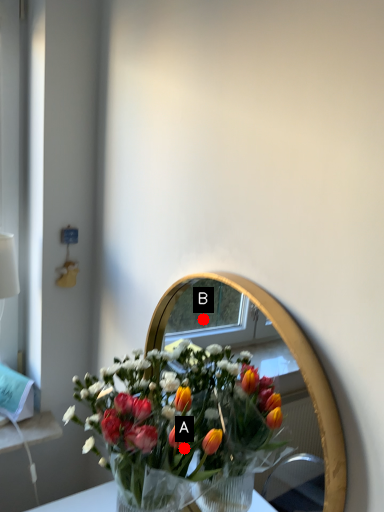
Question: Two points are circled on the image, labeled by A and B beside each circle. Which of the following is the closest to the observer?

Choices:
 (A) A is closer
 (B) B is closer

Answer: (A)